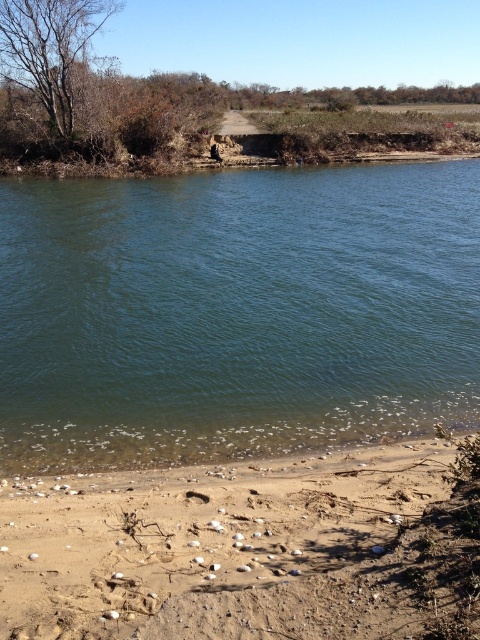
You are standing on the brown sandy beach at lower right and want to reach the green smooth water at center. Which direction should you move in to get there?

To reach the green smooth water at center from the brown sandy beach at lower right, you should move towards the center of the image since the green smooth water at center is positioned over the brown sandy beach at lower right.

Looking at this image, you are standing on the brown sandy beach at lower right and want to cross to the green smooth water at center. Which direction should you move to reach it?

You should move to the left to reach the green smooth water at center since it is positioned to the left of the brown sandy beach at lower right.

You are standing at the center of the image and want to locate the green smooth water at center. Which direction should you look to find it?

The green smooth water at center is located at point coordinates approximately 0.489 on the x axis and 0.492 on the y axis, so you should look directly ahead since it is centered in the image.